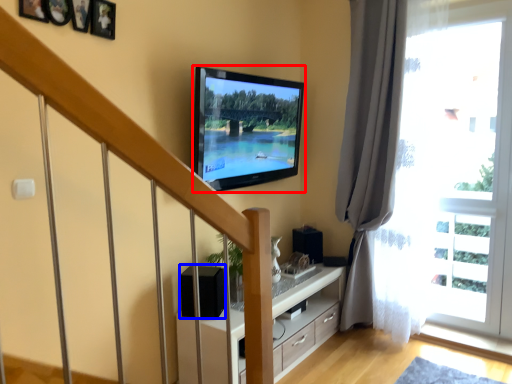
Question: Among these objects, which one is farthest to the camera, television (highlighted by a red box) or speaker (highlighted by a blue box)?

Choices:
 (A) television
 (B) speaker

Answer: (B)